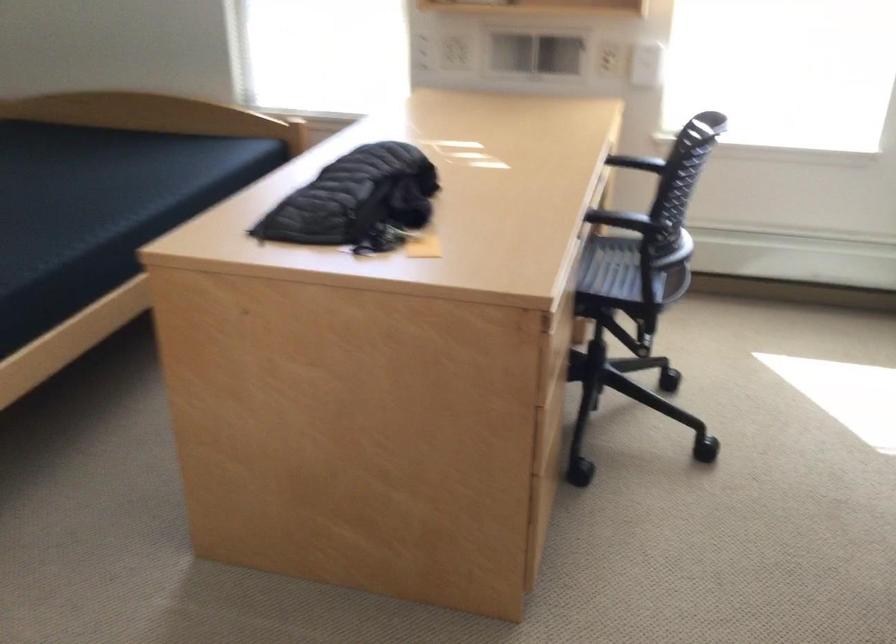
Where would you lift the yellow sticky note? Please return your answer as a coordinate pair (x, y).

(421, 245)